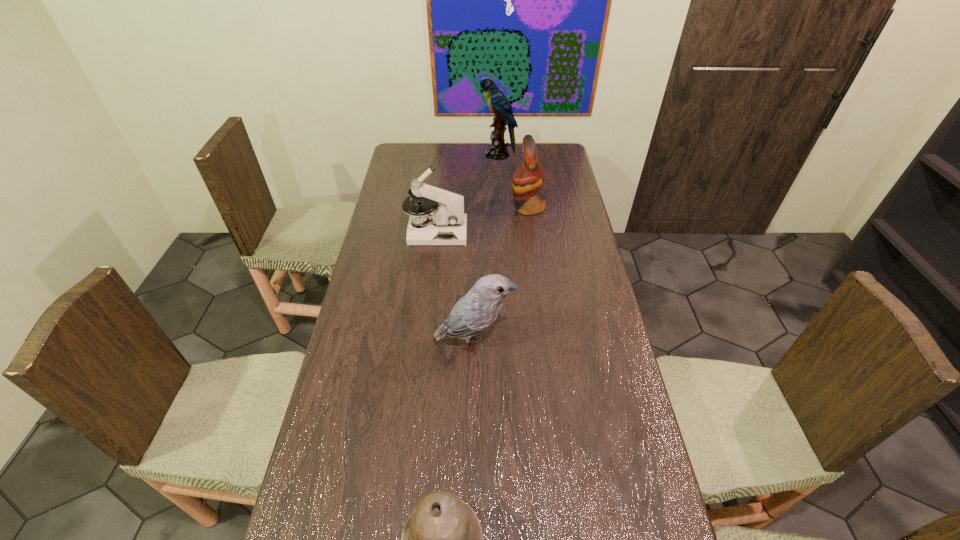
Find the location of `free point located at the eyepiece of the microscope`. free point located at the eyepiece of the microscope is located at coordinates (552, 232).

The width and height of the screenshot is (960, 540). I want to click on free space located 0.210m on the front-facing side of the nearest parrot, so click(x=584, y=342).

Where is `object positioned at the far edge`? This screenshot has width=960, height=540. object positioned at the far edge is located at coordinates (498, 103).

Identify the location of object at the left edge. (444, 224).

You are a GUI agent. You are given a task and a screenshot of the screen. Output one action in this format:
    pyautogui.click(x=<x>, y=<y>)
    Task: Click on the object that is at the right edge
    
    Given the screenshot: What is the action you would take?
    pyautogui.click(x=529, y=177)

Find the location of a particular element. The image size is (960, 540). vacant space at the far edge is located at coordinates (481, 144).

Find the location of a particular element. The height and width of the screenshot is (540, 960). free space at the left edge of the desktop is located at coordinates (381, 228).

The image size is (960, 540). Find the location of `vacant space at the right edge`. vacant space at the right edge is located at coordinates (562, 325).

Where is `free space at the far left corner of the desktop`? free space at the far left corner of the desktop is located at coordinates (420, 142).

The width and height of the screenshot is (960, 540). I want to click on unoccupied area between the second nearest object and the farthest parrot, so click(x=486, y=248).